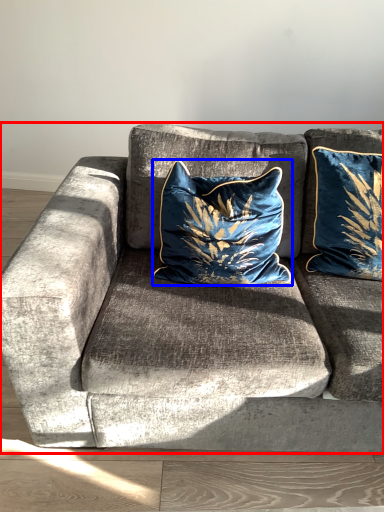
Question: Among these objects, which one is nearest to the camera, studio couch (highlighted by a red box) or pillow (highlighted by a blue box)?

Choices:
 (A) studio couch
 (B) pillow

Answer: (A)